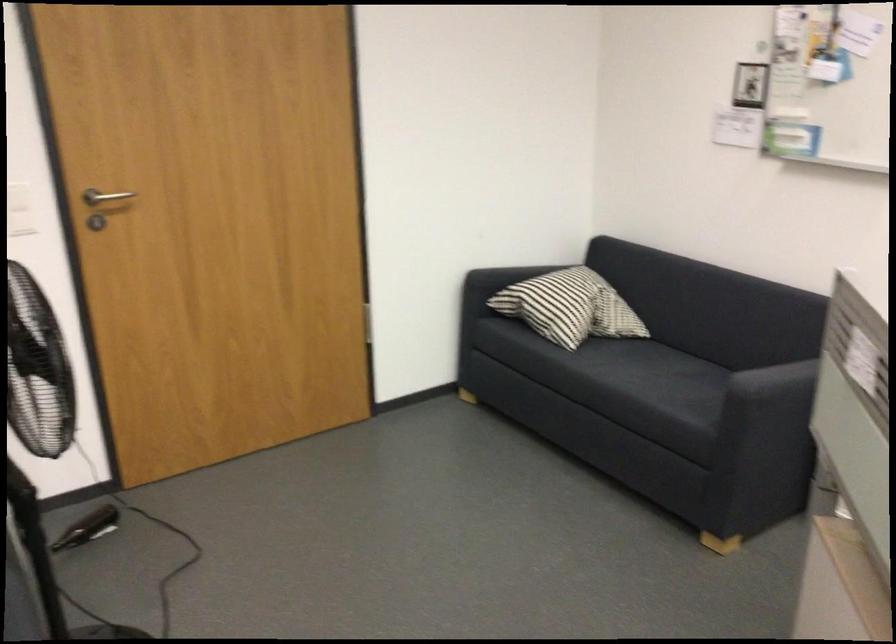
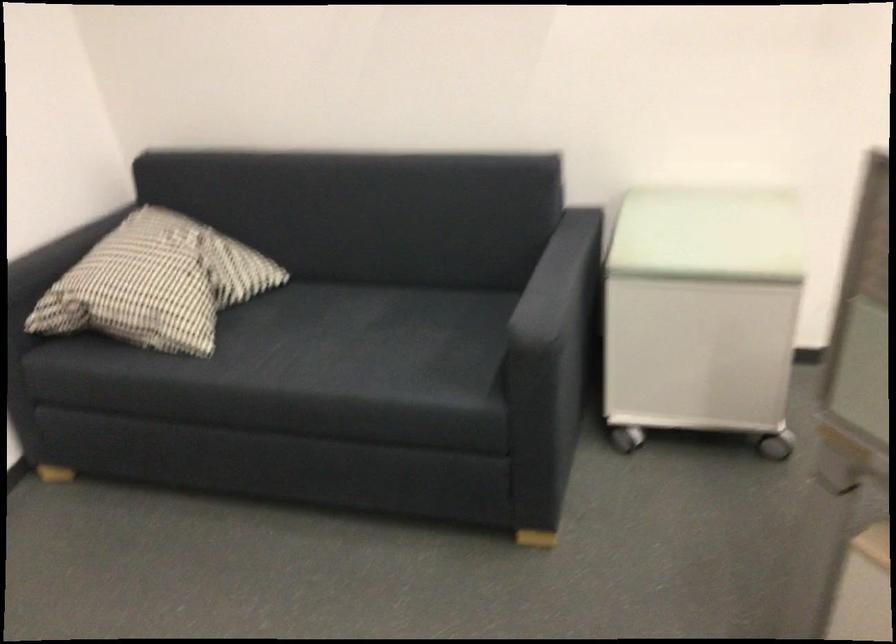
Locate, in the second image, the point that corresponds to the point at 558,299 in the first image.

(156, 283)